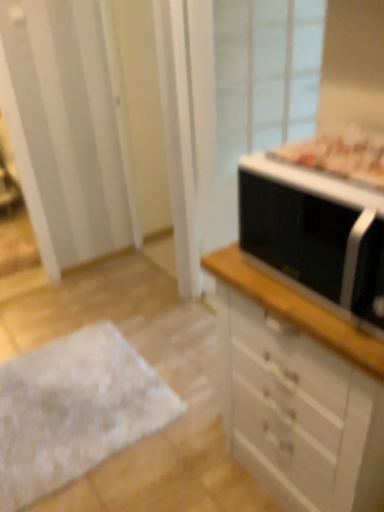
Question: From a real-world perspective, relative to black matte microwave at right, is white glossy chest of drawers at right vertically above or below?

Choices:
 (A) below
 (B) above

Answer: (A)

Question: Is white glossy chest of drawers at right in front of or behind black matte microwave at right in the image?

Choices:
 (A) front
 (B) behind

Answer: (B)

Question: Estimate the real-world distances between objects in this image. Which object is farther from the transparent glass screen door at upper right?

Choices:
 (A) black matte microwave at right
 (B) white fluffy rug at lower left
 (C) white glossy chest of drawers at right

Answer: (A)

Question: Estimate the real-world distances between objects in this image. Which object is closer to the white glossy chest of drawers at right?

Choices:
 (A) black matte microwave at right
 (B) white fluffy rug at lower left
 (C) transparent glass screen door at upper right

Answer: (A)